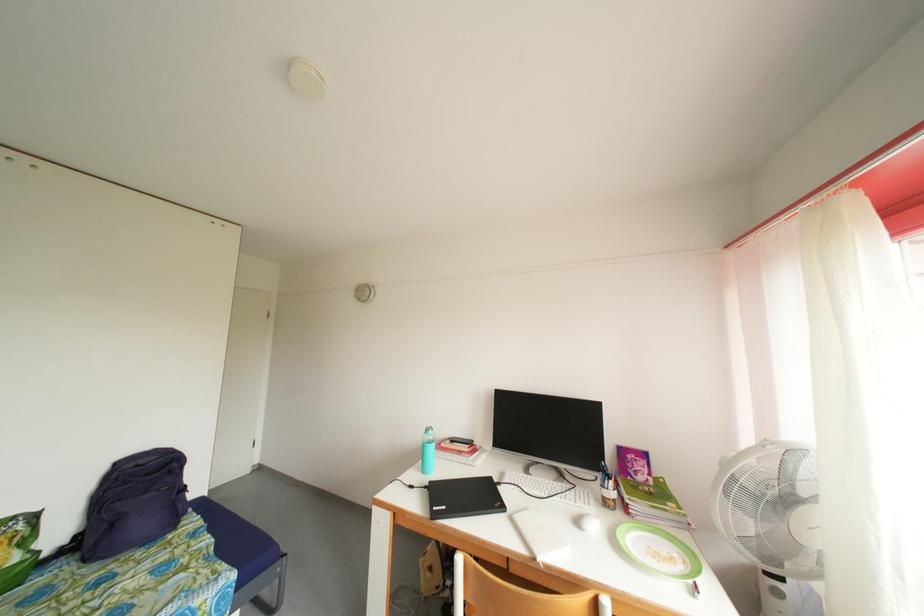
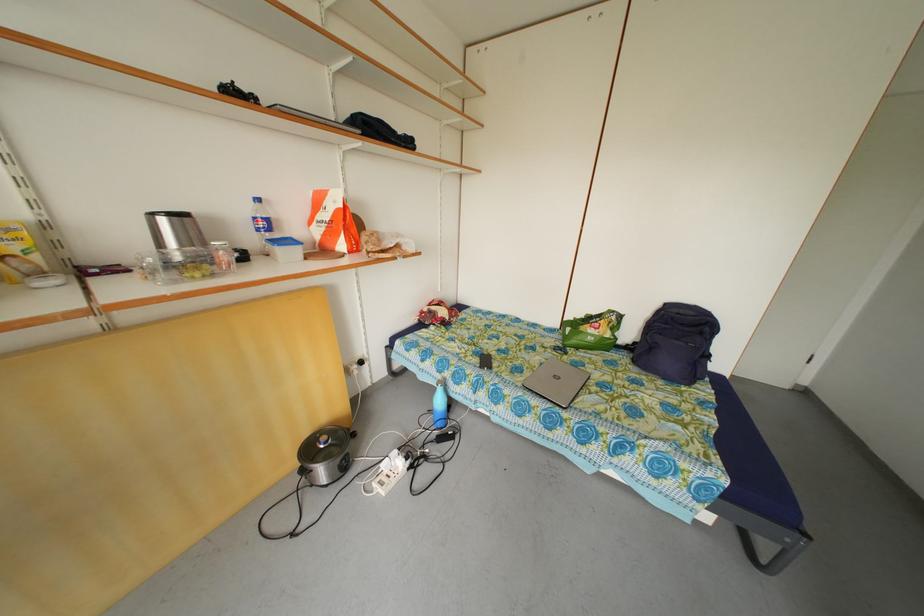
In the second image, find the point that corresponds to the point at 124,469 in the first image.

(673, 310)